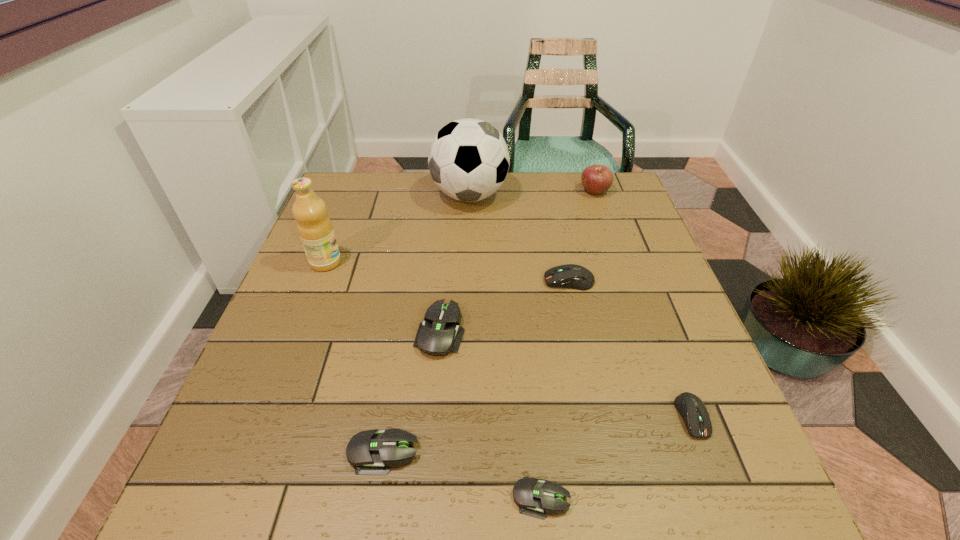
In the image, there is a desktop. Where is `vacant space at the far edge`? The height and width of the screenshot is (540, 960). vacant space at the far edge is located at coordinates (558, 197).

At what (x,y) coordinates should I click in order to perform the action: click on vacant space at the left edge of the desktop. Please return your answer as a coordinate pair (x, y). This screenshot has width=960, height=540. Looking at the image, I should click on (347, 323).

Locate an element on the screen. free region at the right edge of the desktop is located at coordinates (684, 349).

Locate an element on the screen. The height and width of the screenshot is (540, 960). blank area at the far left corner is located at coordinates (331, 188).

Locate an element on the screen. The image size is (960, 540). vacant space at the near left corner of the desktop is located at coordinates (272, 516).

This screenshot has height=540, width=960. What are the coordinates of `vacant space in between the farthest gray computer mouse and the black soccer ball` in the screenshot? It's located at (455, 264).

This screenshot has width=960, height=540. I want to click on free space between the apple and the nearest object, so click(567, 345).

Where is `free space that is in between the farthest gray computer mouse and the olive oil`? The height and width of the screenshot is (540, 960). free space that is in between the farthest gray computer mouse and the olive oil is located at coordinates (383, 297).

Identify the location of free point between the third object from right to left and the smaller dark computer equipment. This screenshot has width=960, height=540. (631, 349).

Find the location of a particular element. vacant region between the second nearest gray computer mouse and the nearest computer mouse is located at coordinates (463, 475).